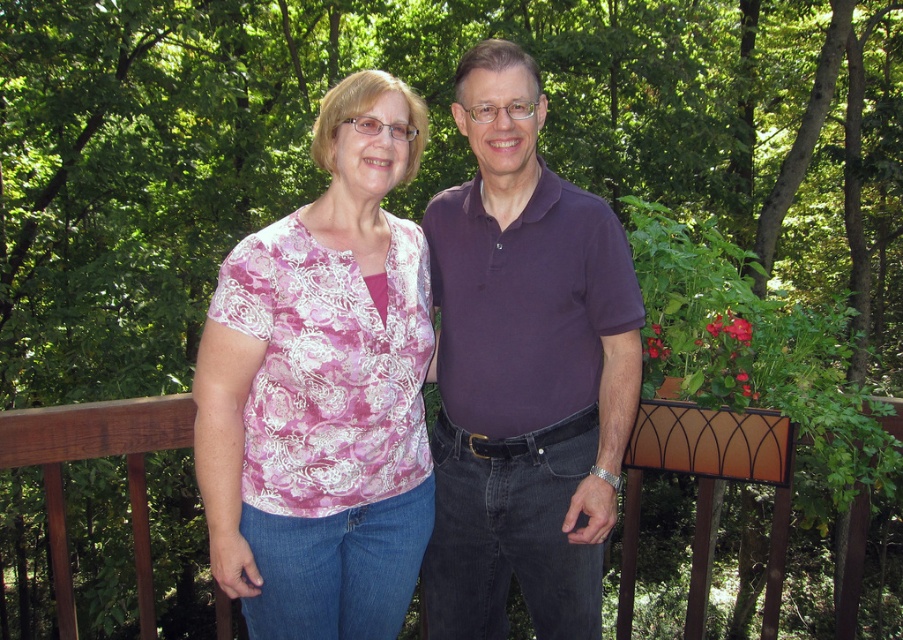
Question: Does pink floral blouse at center come behind brown wooden rail at center?

Choices:
 (A) yes
 (B) no

Answer: (B)

Question: From the image, what is the correct spatial relationship of pink floral blouse at center in relation to purple cotton shirt at center?

Choices:
 (A) above
 (B) below

Answer: (A)

Question: Based on their relative distances, which object is nearer to the purple cotton shirt at center?

Choices:
 (A) brown wooden rail at center
 (B) pink floral blouse at center

Answer: (B)

Question: Does pink floral blouse at center have a lesser width compared to purple cotton shirt at center?

Choices:
 (A) no
 (B) yes

Answer: (B)

Question: Which point is farther from the camera taking this photo?

Choices:
 (A) (782, 564)
 (B) (340, 252)

Answer: (A)

Question: Which of these objects is positioned farthest from the brown wooden rail at center?

Choices:
 (A) pink floral blouse at center
 (B) purple cotton shirt at center

Answer: (A)